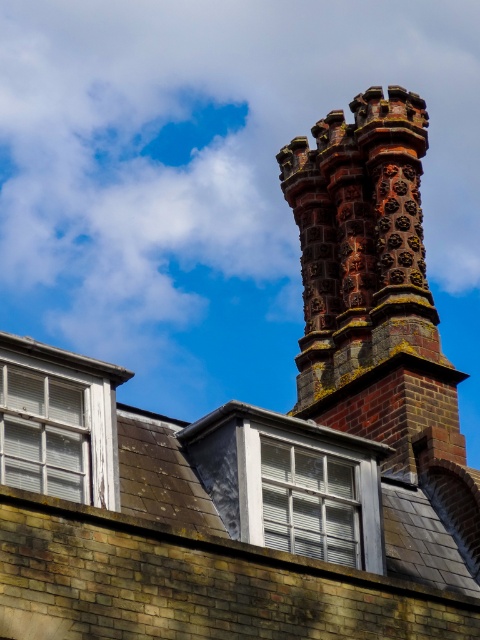
You are standing on the roof and looking at the clear glass window at center located at point (x=310, y=502). Is there any object at that point?

Yes, at point (x=310, y=502) there is a clear glass window at center.

You are a window cleaner standing at the point marked as point (x=369, y=275). Looking at the building, you see the rustic brick chimney at upper center. Is your current position on the chimney or not?

The point (x=369, y=275) is on the rustic brick chimney at upper center, so yes, your current position is on the chimney.